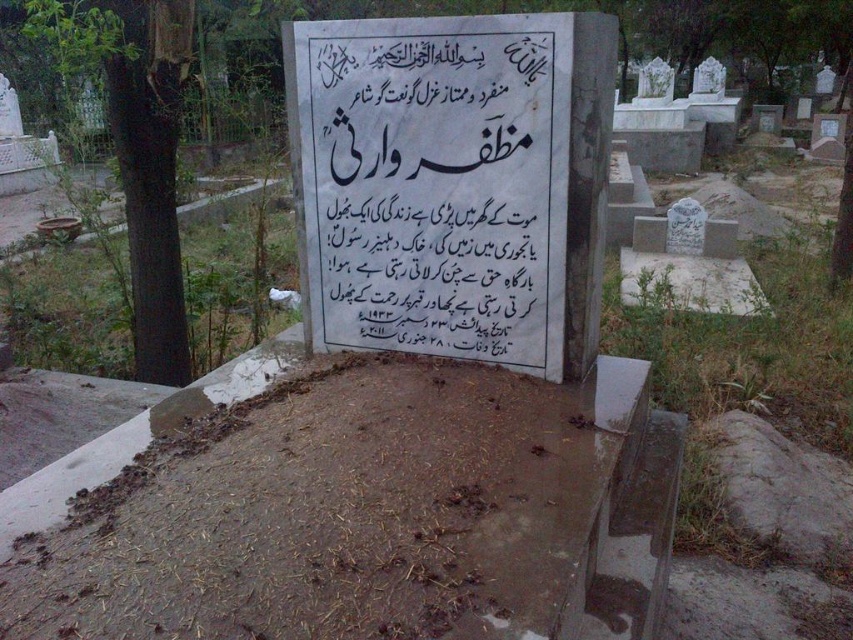
You are a groundskeeper trying to place a new rectangular garden bed that is 2 meters wide. You have two options for placement near the brown dirt at lower center and the white marble sign at center. Based on their widths, which area can accommodate the garden bed?

The brown dirt at lower center has a greater width than the white marble sign at center, so the garden bed can be placed in the brown dirt at lower center since its width is sufficient to accommodate the 2 meter wide garden bed.

You are standing in the cemetery and want to place a small bouquet of flowers between the two points marked as point (x=296, y=484) and point (x=596, y=100). Which point should you approach first to ensure the bouquet is closer to the viewer?

You should approach point (x=296, y=484) first because it is closer to the viewer than point (x=596, y=100), so placing the bouquet there will keep it nearer to your position.